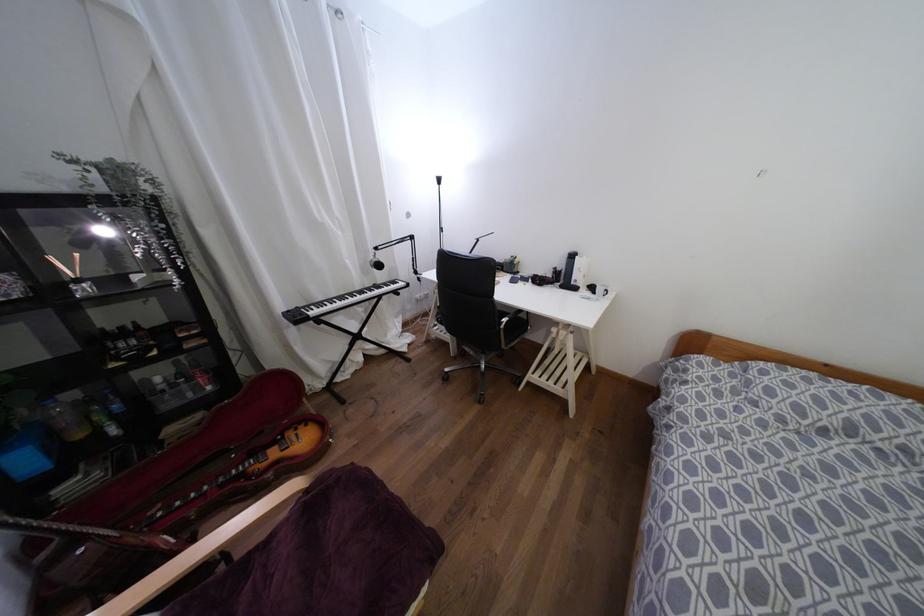
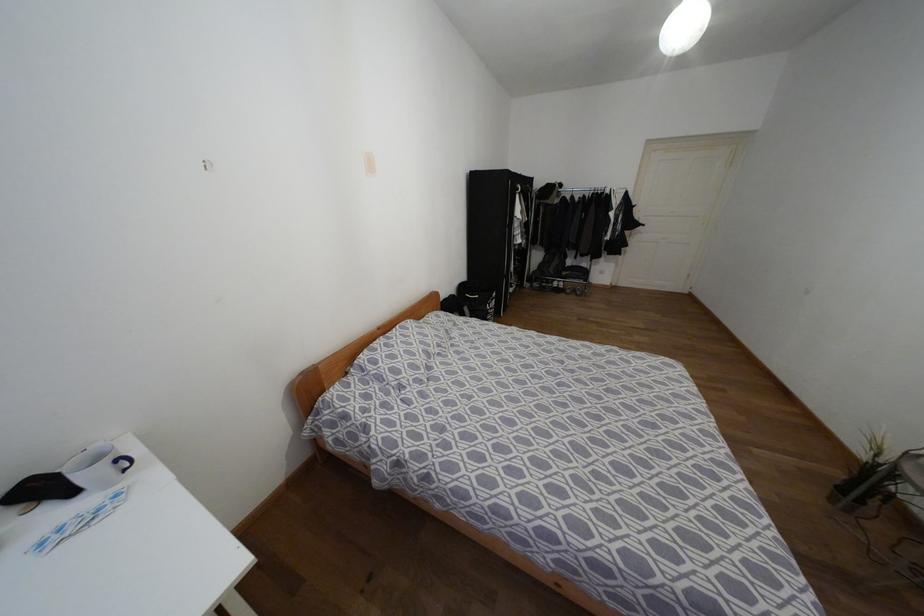
Find the pixel in the second image that matches point 604,290 in the first image.

(119, 459)